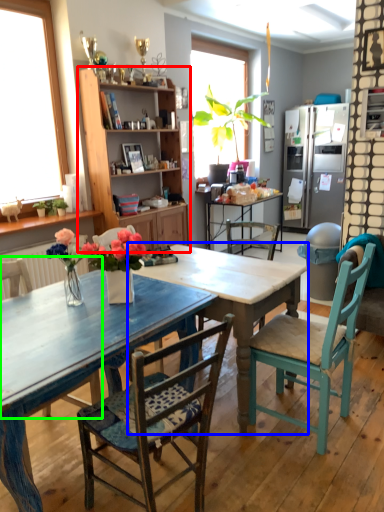
Question: Which object is positioned farthest from cabinetry (highlighted by a red box)? Select from table (highlighted by a blue box) and chair (highlighted by a green box).

Choices:
 (A) table
 (B) chair

Answer: (B)